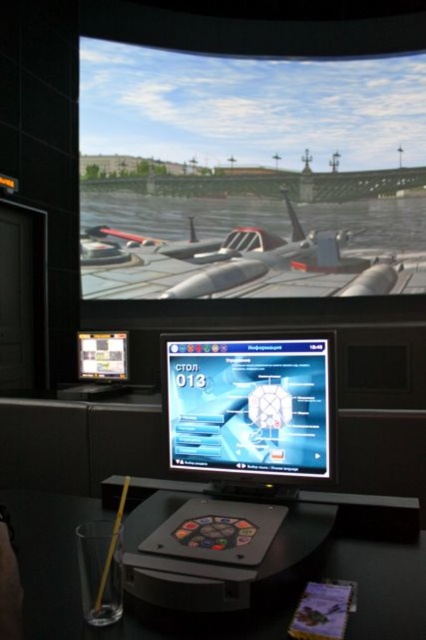
Question: Does shiny silver aircraft at center appear under black plastic table at lower center?

Choices:
 (A) yes
 (B) no

Answer: (B)

Question: Considering the relative positions of shiny silver monitor at center and matte plastic screen at upper left in the image provided, where is shiny silver monitor at center located with respect to matte plastic screen at upper left?

Choices:
 (A) left
 (B) right

Answer: (B)

Question: Can you confirm if shiny silver aircraft at center is positioned above shiny silver monitor at center?

Choices:
 (A) yes
 (B) no

Answer: (A)

Question: Among these points, which one is farthest from the camera?

Choices:
 (A) (264, 342)
 (B) (100, 339)

Answer: (B)

Question: Which of the following is the farthest from the observer?

Choices:
 (A) (322, 257)
 (B) (402, 618)

Answer: (A)

Question: Which is nearer to the matte plastic screen at upper left?

Choices:
 (A) black plastic table at lower center
 (B) shiny silver monitor at center

Answer: (A)